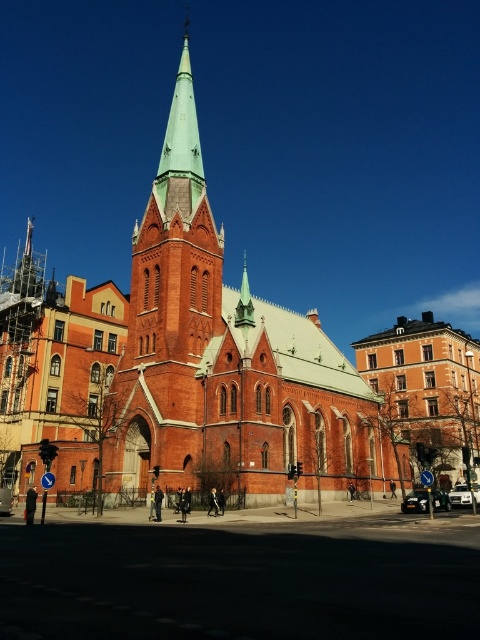
Question: Observing the image, what is the correct spatial positioning of red brick church at center in reference to metallic silver car at center?

Choices:
 (A) below
 (B) above

Answer: (B)

Question: From the image, what is the correct spatial relationship of metallic silver car at center in relation to metallic silver car at lower right?

Choices:
 (A) below
 (B) above

Answer: (A)

Question: Which point appears farthest from the camera in this image?

Choices:
 (A) (x=288, y=394)
 (B) (x=418, y=497)
 (C) (x=12, y=499)

Answer: (A)

Question: Considering the real-world distances, which object is closest to the red brick church at center?

Choices:
 (A) metallic silver car at lower right
 (B) metallic silver car at lower left
 (C) metallic silver car at center

Answer: (C)

Question: Considering the real-world distances, which object is closest to the metallic silver car at lower left?

Choices:
 (A) metallic silver car at center
 (B) red brick church at center
 (C) metallic silver car at lower right

Answer: (A)

Question: Is red brick church at center below metallic silver car at lower right?

Choices:
 (A) no
 (B) yes

Answer: (A)